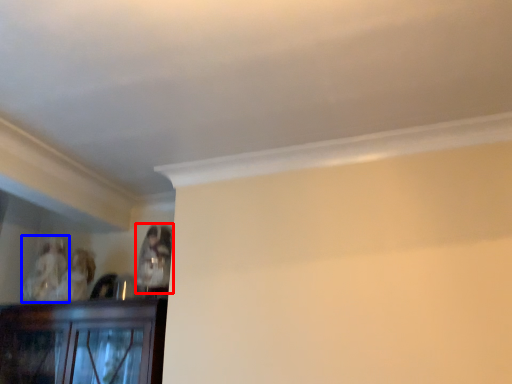
Question: Which object is closer to the camera taking this photo, person (highlighted by a red box) or person (highlighted by a blue box)?

Choices:
 (A) person
 (B) person

Answer: (A)